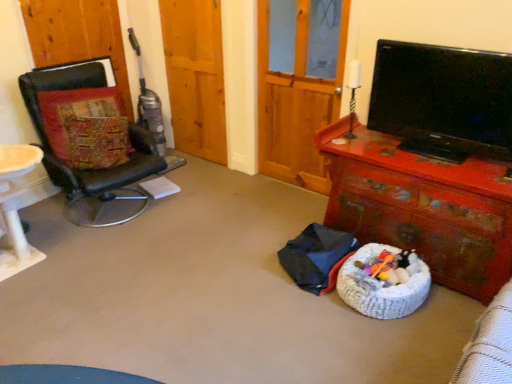
The width and height of the screenshot is (512, 384). I want to click on unoccupied area in front of black leather chair at left, so click(113, 263).